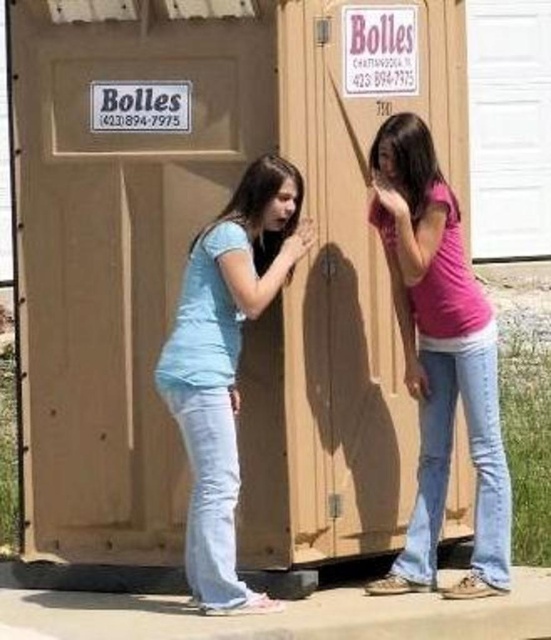
Question: Considering the relative positions of pink matte shirt at center and matte blue shirt at center in the image provided, where is pink matte shirt at center located with respect to matte blue shirt at center?

Choices:
 (A) left
 (B) right

Answer: (B)

Question: Can you confirm if pink matte shirt at center is thinner than matte blue shirt at center?

Choices:
 (A) no
 (B) yes

Answer: (B)

Question: Which point is farther to the camera?

Choices:
 (A) pink matte shirt at center
 (B) matte blue shirt at center

Answer: (A)

Question: Is pink matte shirt at center smaller than matte blue shirt at center?

Choices:
 (A) yes
 (B) no

Answer: (B)

Question: Which point is farther to the camera?

Choices:
 (A) (410, 248)
 (B) (171, 353)

Answer: (A)